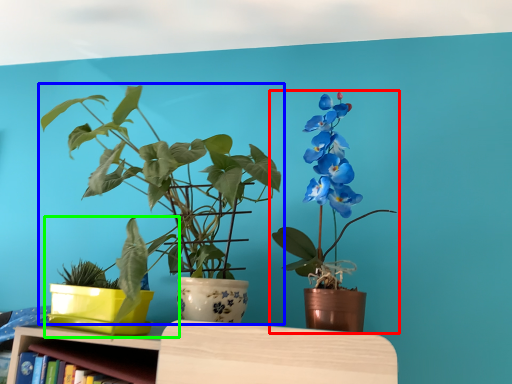
Question: Which is farther away from houseplant (highlighted by a red box)? houseplant (highlighted by a blue box) or houseplant (highlighted by a green box)?

Choices:
 (A) houseplant
 (B) houseplant

Answer: (B)